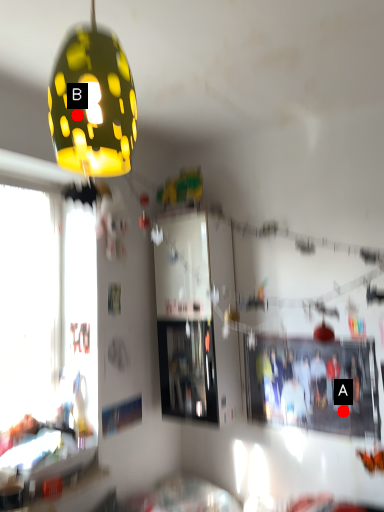
Question: Two points are circled on the image, labeled by A and B beside each circle. Which point is closer to the camera?

Choices:
 (A) A is closer
 (B) B is closer

Answer: (B)